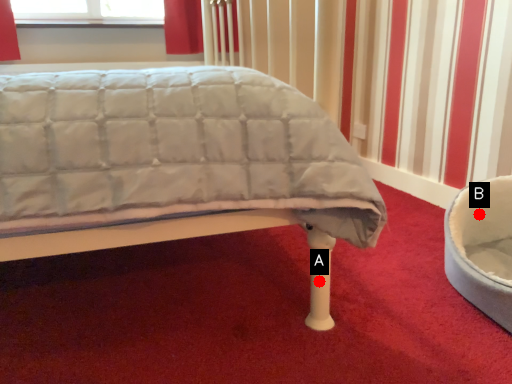
Question: Two points are circled on the image, labeled by A and B beside each circle. Which point is farther to the camera?

Choices:
 (A) A is further
 (B) B is further

Answer: (B)